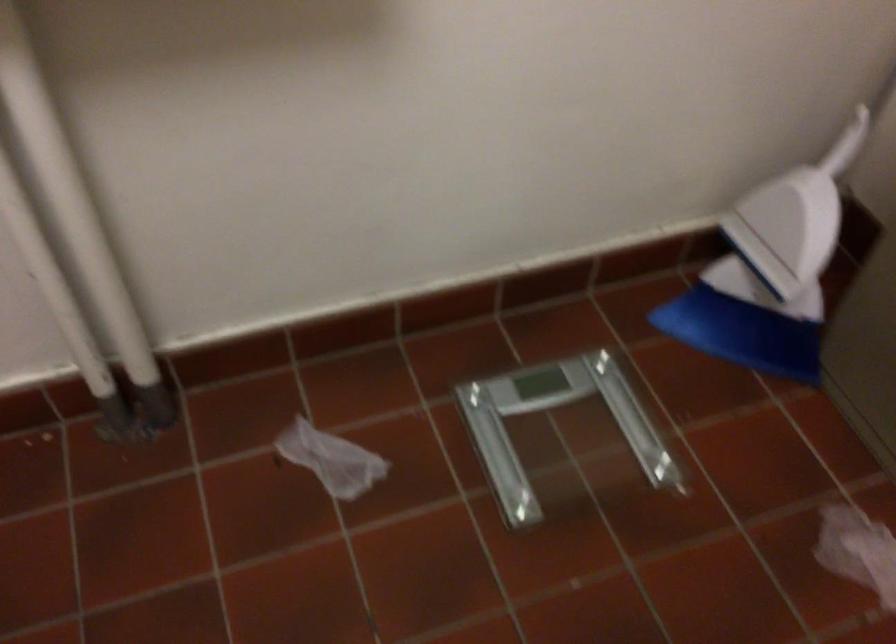
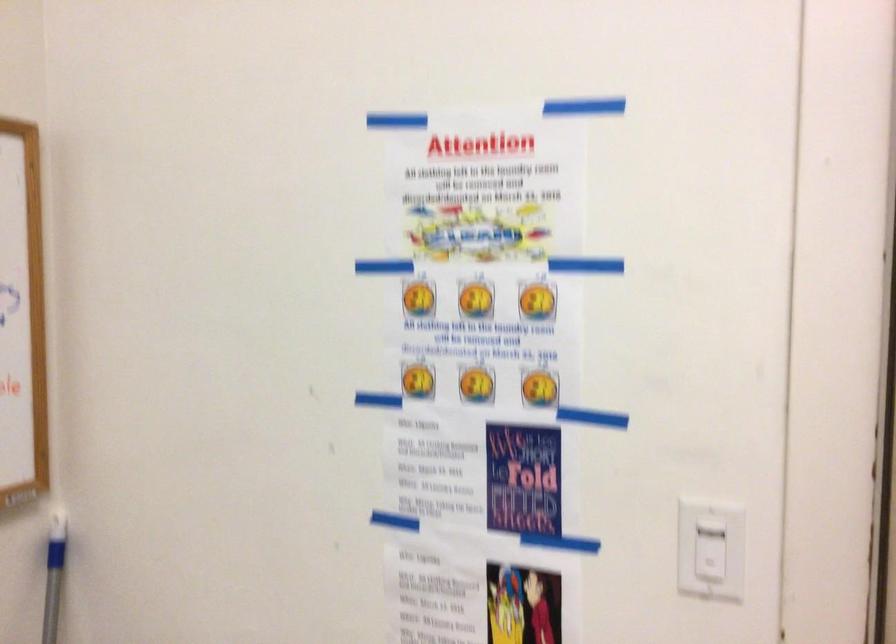
How did the camera likely rotate?

The camera's rotation is toward right-down.